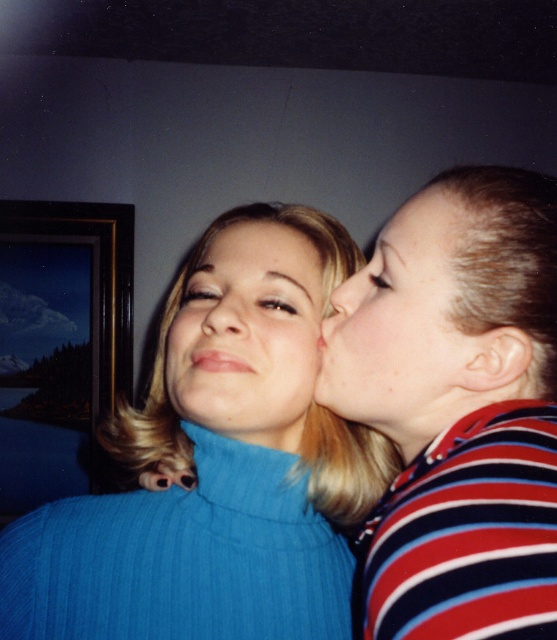
Which is above, matte skin face at upper right or matte blue sweater at center?

matte skin face at upper right is above.

Who is positioned more to the right, matte skin face at upper right or matte blue sweater at center?

Positioned to the right is matte skin face at upper right.

Which is in front, point (434, 305) or point (236, 320)?

Point (434, 305) is more forward.

Identify the location of matte skin face at upper right. (403, 328).

Does point (179, 454) lie behind point (104, 390)?

No, it is in front of (104, 390).

Does blue ribbed turtleneck at center have a greater height compared to wooden picture frame at upper left?

In fact, blue ribbed turtleneck at center may be shorter than wooden picture frame at upper left.

The image size is (557, 640). Describe the element at coordinates (214, 480) in the screenshot. I see `blue ribbed turtleneck at center` at that location.

I want to click on blue ribbed turtleneck at center, so tap(214, 480).

Is blue ribbed turtleneck at center closer to camera compared to smooth blonde hair at upper center?

Yes, it is.

Which is more to the right, blue ribbed turtleneck at center or smooth blonde hair at upper center?

Positioned to the right is smooth blonde hair at upper center.

Which is in front, point (255, 340) or point (246, 257)?

Point (255, 340)

Where is `blue ribbed turtleneck at center`? Image resolution: width=557 pixels, height=640 pixels. blue ribbed turtleneck at center is located at coordinates (214, 480).